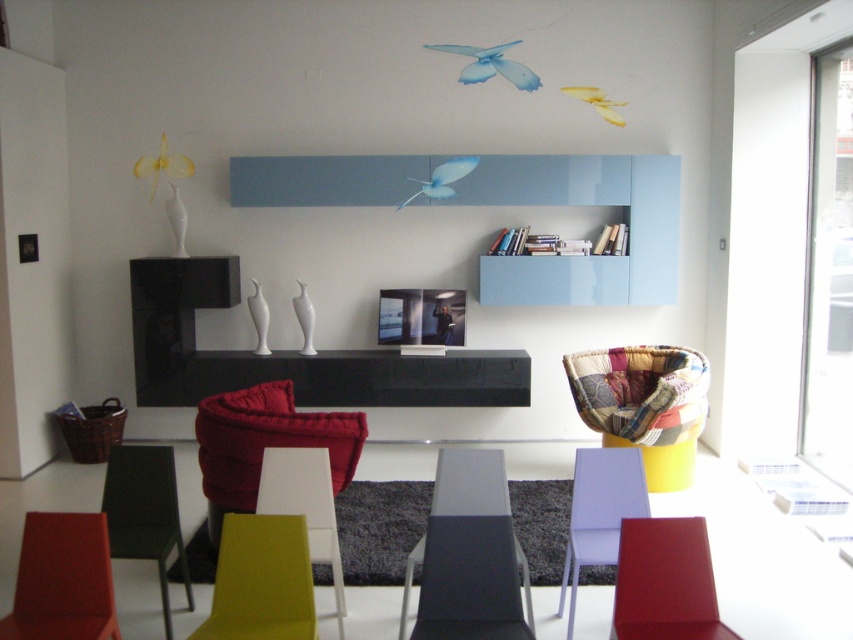
Question: Does matte yellow armchair at lower center come behind matte red armchair at lower right?

Choices:
 (A) no
 (B) yes

Answer: (B)

Question: Which point is farther to the camera?

Choices:
 (A) (321, 532)
 (B) (99, 528)
 (C) (242, 625)

Answer: (A)

Question: Among these points, which one is farthest from the camera?

Choices:
 (A) (456, 621)
 (B) (592, 504)
 (C) (287, 410)

Answer: (C)

Question: Does matte black table at center appear over patchwork fabric armchair at lower right?

Choices:
 (A) no
 (B) yes

Answer: (A)

Question: Which object is the closest to the matte yellow armchair at lower center?

Choices:
 (A) matte yellow chair at center
 (B) matte purple armchair at center
 (C) matte red chair at lower left
 (D) matte black table at center

Answer: (C)

Question: Is velvet red armchair at center to the right of matte red chair at lower left from the viewer's perspective?

Choices:
 (A) no
 (B) yes

Answer: (B)